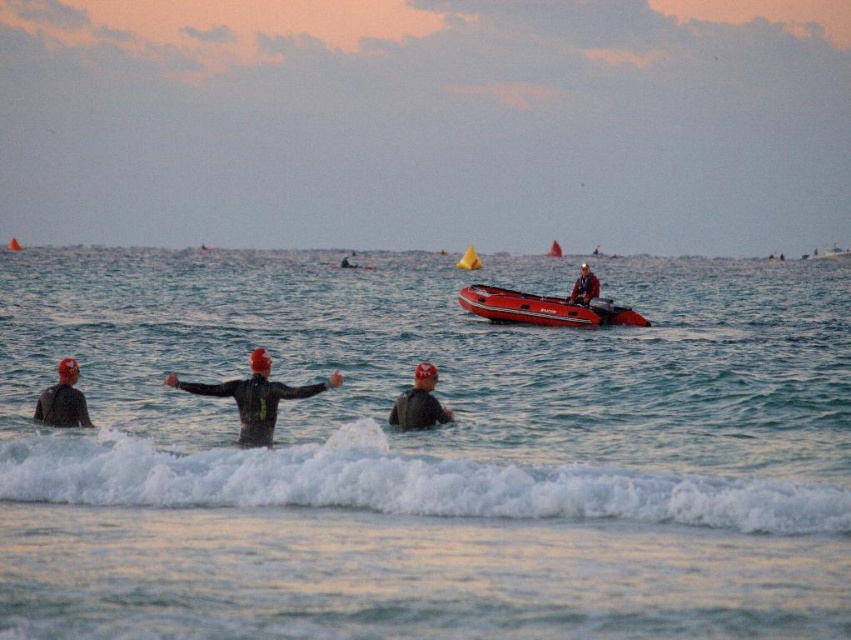
Between rubberized red boat at center and matte red life jacket at center, which one is positioned higher?

Positioned higher is matte red life jacket at center.

Which is in front, point (475, 296) or point (574, 292)?

Positioned in front is point (574, 292).

The height and width of the screenshot is (640, 851). What are the coordinates of `rubberized red boat at center` in the screenshot? It's located at (543, 308).

Is clear water at center smaller than white foamy wave at lower center?

Actually, clear water at center might be larger than white foamy wave at lower center.

Is clear water at center taller than white foamy wave at lower center?

Correct, clear water at center is much taller as white foamy wave at lower center.

Is point (315, 467) positioned after point (757, 476)?

No, (315, 467) is in front of (757, 476).

Locate an element on the screen. The width and height of the screenshot is (851, 640). clear water at center is located at coordinates (426, 456).

Is the position of clear water at center more distant than that of matte black wetsuit at center?

That is False.

Does clear water at center have a greater height compared to matte black wetsuit at center?

Indeed, clear water at center has a greater height compared to matte black wetsuit at center.

Identify the location of clear water at center. This screenshot has height=640, width=851. (426, 456).

Identify the location of clear water at center. (426, 456).